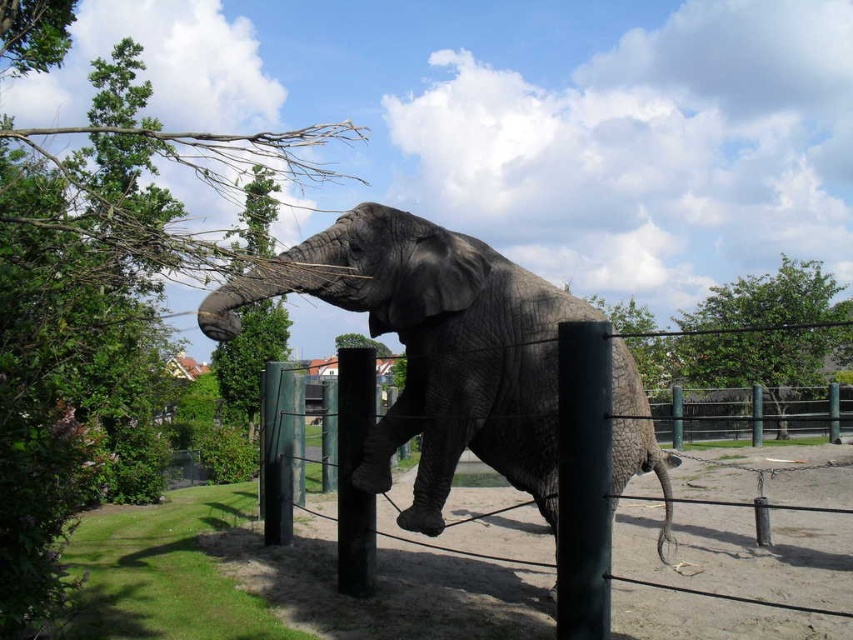
Is point (146, 472) farther from viewer compared to point (425, 237)?

That is True.

What do you see at coordinates (91, 316) in the screenshot? The image size is (853, 640). I see `green leafy tree at upper left` at bounding box center [91, 316].

Find the location of a particular element. The height and width of the screenshot is (640, 853). green leafy tree at upper left is located at coordinates (91, 316).

Between green painted metal fence at center and gray textured elephant at center, which one appears on the right side from the viewer's perspective?

From the viewer's perspective, gray textured elephant at center appears more on the right side.

Is green painted metal fence at center smaller than gray textured elephant at center?

Indeed, green painted metal fence at center has a smaller size compared to gray textured elephant at center.

Which is in front, point (688, 605) or point (630, 385)?

Point (630, 385) is more forward.

In order to click on green painted metal fence at center in this screenshot , I will do `click(734, 563)`.

The width and height of the screenshot is (853, 640). What do you see at coordinates (434, 348) in the screenshot?
I see `gray textured elephant at center` at bounding box center [434, 348].

Does gray textured elephant at center have a greater width compared to black metal pole at center?

Correct, the width of gray textured elephant at center exceeds that of black metal pole at center.

Identify the location of gray textured elephant at center. (434, 348).